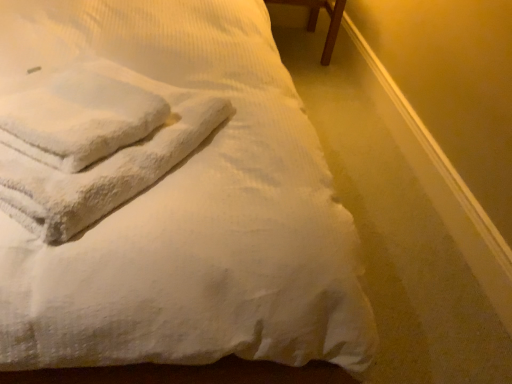
Question: Is point (90, 82) closer or farther from the camera than point (117, 297)?

Choices:
 (A) closer
 (B) farther

Answer: (B)

Question: Visually, is white fluffy bath towel at upper left, which is the first bath towel from left to right, positioned to the left or to the right of white soft towel at upper left?

Choices:
 (A) right
 (B) left

Answer: (A)

Question: Which of these objects is positioned farthest from the white fluffy bath towel at upper left, which is the first bath towel from left to right?

Choices:
 (A) white soft towel at upper left
 (B) white fluffy towel at upper left, the first bath towel positioned from the right
 (C) brown wooden table at upper right

Answer: (C)

Question: Considering the real-world distances, which object is farthest from the white fluffy bath towel at upper left, placed as the second bath towel when sorted from right to left?

Choices:
 (A) white soft towel at upper left
 (B) brown wooden table at upper right
 (C) white fluffy towel at upper left, the first bath towel positioned from the right

Answer: (B)